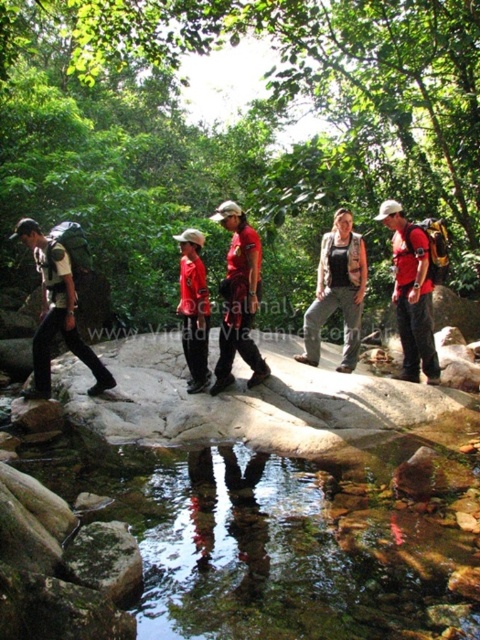
Question: Considering the real-world distances, which object is closest to the matte red shirt at center?

Choices:
 (A) red matte shirt at center
 (B) clear glass water at center
 (C) green matte forest at center
 (D) denim jacket at center

Answer: (D)

Question: Which point is farther from the camera taking this photo?

Choices:
 (A) (420, 301)
 (B) (104, 38)
 (C) (465, 460)

Answer: (B)

Question: Can you confirm if clear glass water at center is positioned to the left of red matte shirt at center?

Choices:
 (A) no
 (B) yes

Answer: (B)

Question: Which of the following is the farthest from the observer?

Choices:
 (A) (448, 570)
 (B) (206, 300)

Answer: (B)

Question: In this image, where is clear glass water at center located relative to red matte shirt at center?

Choices:
 (A) left
 (B) right

Answer: (A)

Question: Does green matte forest at center appear on the right side of red matte shirt at center?

Choices:
 (A) no
 (B) yes

Answer: (A)